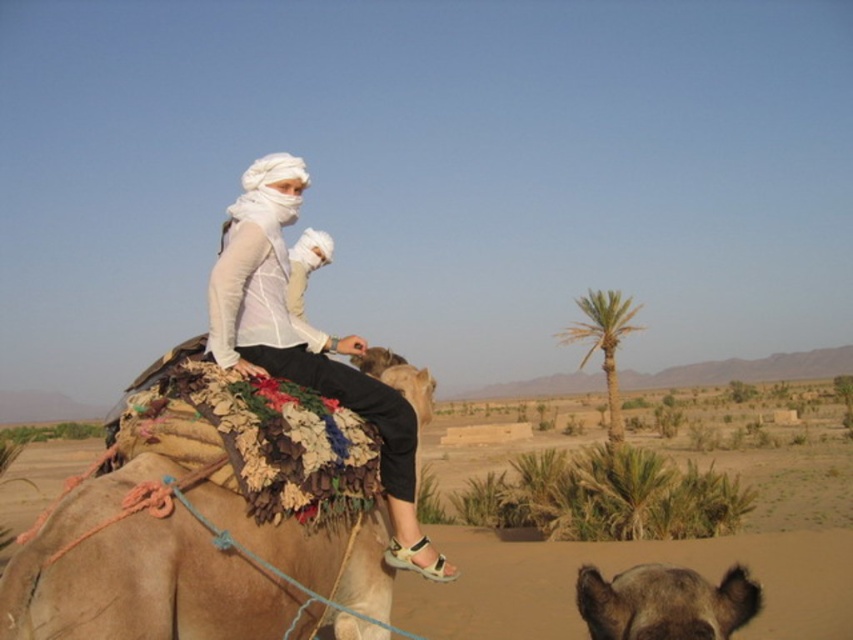
Does white matte clothing at center have a greater width compared to green leafy palm at center?

In fact, white matte clothing at center might be narrower than green leafy palm at center.

Is white matte clothing at center below green leafy palm at center?

Actually, white matte clothing at center is above green leafy palm at center.

Where is `white matte clothing at center`? white matte clothing at center is located at coordinates (306, 342).

Find the location of a particular element. beige textured saddle at center is located at coordinates (181, 557).

Between point (107, 570) and point (393, 454), which one is positioned behind?

Positioned behind is point (393, 454).

Is point (105, 612) farther from viewer compared to point (279, 273)?

No, (105, 612) is closer to viewer.

Find the location of a particular element. The height and width of the screenshot is (640, 853). beige textured saddle at center is located at coordinates (181, 557).

Can you confirm if beige textured saddle at center is shorter than green leafy palm at center?

Yes, beige textured saddle at center is shorter than green leafy palm at center.

In the scene shown: Between beige textured saddle at center and green leafy palm at center, which one is positioned lower?

green leafy palm at center

Between point (297, 554) and point (587, 353), which one is positioned in front?

Positioned in front is point (297, 554).

Locate an element on the screen. beige textured saddle at center is located at coordinates (181, 557).